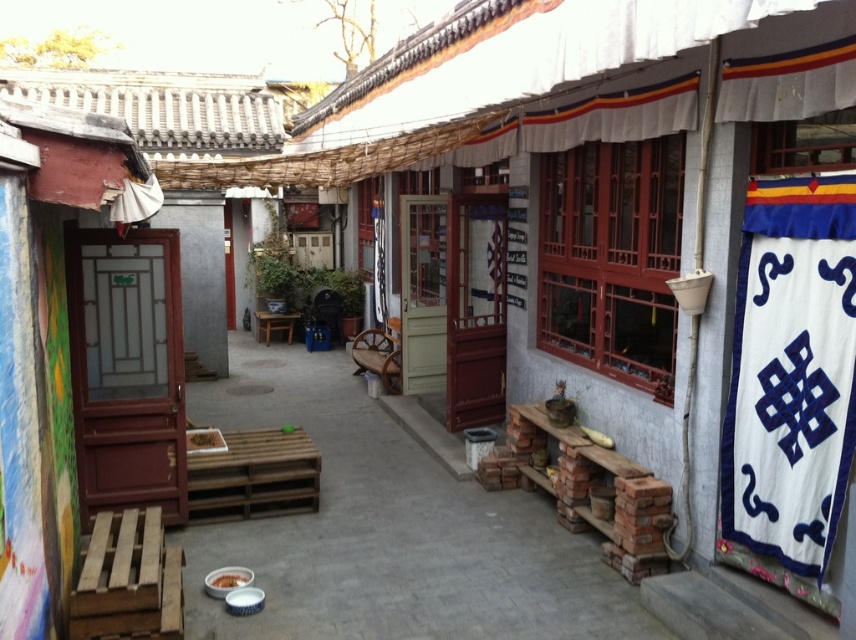
You are a photographer standing in the courtyard and want to capture the white fabric banner at right in your shot. If your camera has a minimum focus distance of 3 meters, will you be able to take a clear photo of the banner without moving closer?

The white fabric banner at right is 3.19 meters away from the camera. Since the minimum focus distance is 3 meters, the banner is within the camera range, so yes, you can take a clear photo without moving closer.

Consider the image. You are standing in the courtyard and want to hang a new decorative item between the white fabric banner at right and the wooden stool at center. Based on their positions, which object should the new item be closer to?

The white fabric banner at right is positioned on the right side of the wooden stool at center, so the new decorative item should be placed closer to the wooden stool at center to maintain symmetry between the two objects.